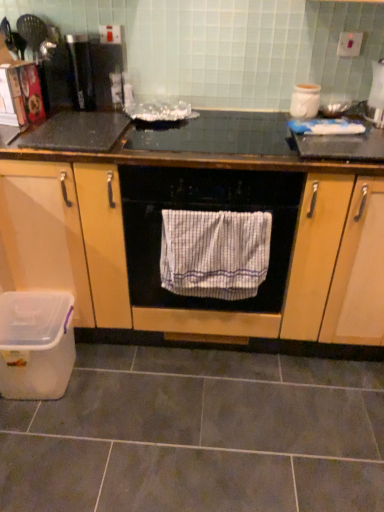
Locate an element on the screen. free spot to the right of transparent plastic container at lower left is located at coordinates (114, 384).